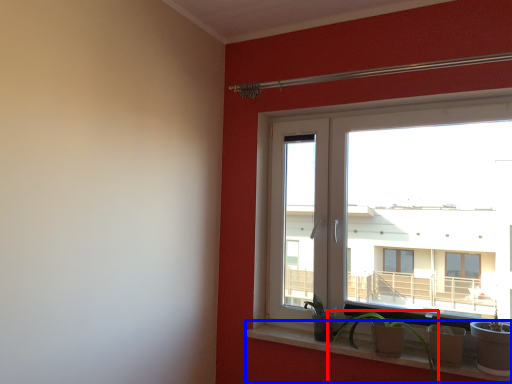
Question: Which of the following is the closest to the observer, houseplant (highlighted by a red box) or window sill (highlighted by a blue box)?

Choices:
 (A) houseplant
 (B) window sill

Answer: (A)